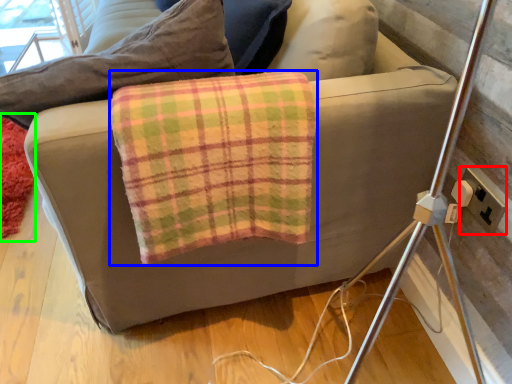
Question: Based on their relative distances, which object is nearer to electric outlet (highlighted by a red box)? Choose from material (highlighted by a blue box) and mat (highlighted by a green box).

Choices:
 (A) material
 (B) mat

Answer: (A)